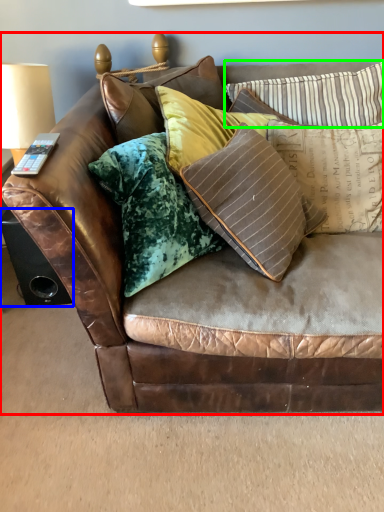
Question: Which is farther away from studio couch (highlighted by a red box)? speaker (highlighted by a blue box) or pillow (highlighted by a green box)?

Choices:
 (A) speaker
 (B) pillow

Answer: (A)